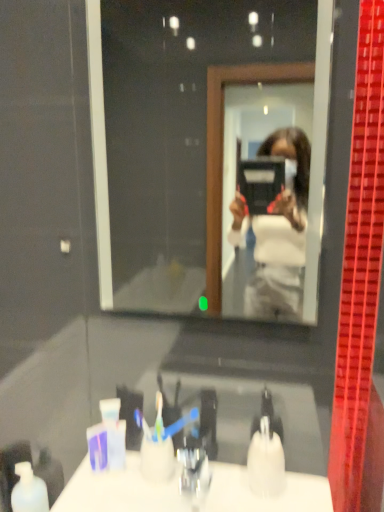
Question: Is white glossy counter top at lower center further to camera compared to white matte bottle at lower left?

Choices:
 (A) no
 (B) yes

Answer: (A)

Question: From the image's perspective, is white glossy counter top at lower center on white matte bottle at lower left?

Choices:
 (A) no
 (B) yes

Answer: (B)

Question: From a real-world perspective, is white glossy counter top at lower center physically above white matte bottle at lower left?

Choices:
 (A) yes
 (B) no

Answer: (A)

Question: Would you say white glossy counter top at lower center contains white matte bottle at lower left?

Choices:
 (A) yes
 (B) no

Answer: (B)

Question: Is white glossy counter top at lower center with white matte bottle at lower left?

Choices:
 (A) no
 (B) yes

Answer: (A)

Question: Could you tell me if white glossy counter top at lower center is turned towards white matte bottle at lower left?

Choices:
 (A) no
 (B) yes

Answer: (A)

Question: Considering the relative positions of white matte bottle at lower left and white glossy counter top at lower center in the image provided, is white matte bottle at lower left behind white glossy counter top at lower center?

Choices:
 (A) no
 (B) yes

Answer: (B)

Question: Is white matte bottle at lower left turned away from white glossy counter top at lower center?

Choices:
 (A) no
 (B) yes

Answer: (A)

Question: From a real-world perspective, is white matte bottle at lower left on top of white glossy counter top at lower center?

Choices:
 (A) no
 (B) yes

Answer: (A)

Question: Does white matte bottle at lower left turn towards white glossy counter top at lower center?

Choices:
 (A) no
 (B) yes

Answer: (A)

Question: Is white matte bottle at lower left wider than white glossy counter top at lower center?

Choices:
 (A) yes
 (B) no

Answer: (B)

Question: Is white matte bottle at lower left not inside white glossy counter top at lower center?

Choices:
 (A) yes
 (B) no

Answer: (A)

Question: From a real-world perspective, is white matte bottle at lower left over translucent plastic soap dispenser at lower center?

Choices:
 (A) yes
 (B) no

Answer: (B)